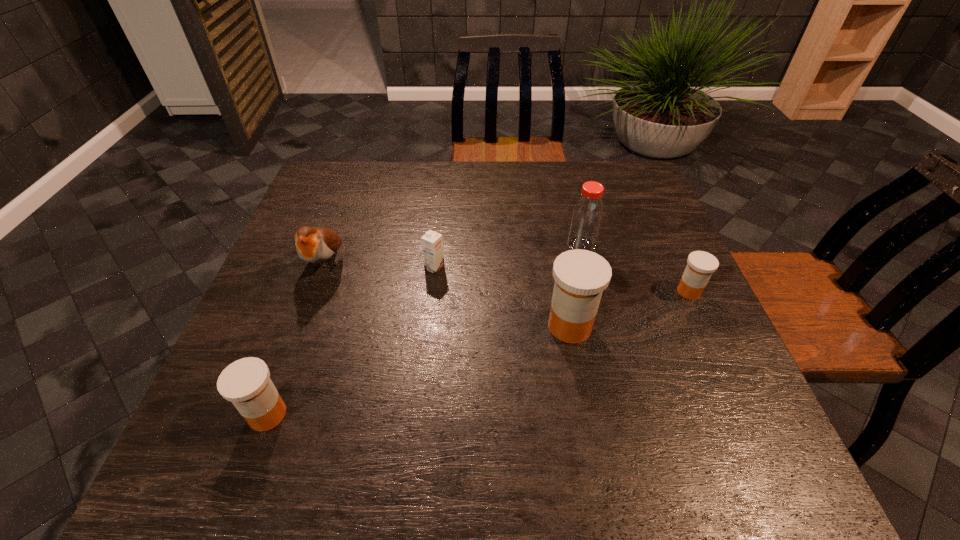
Please point a space for a new medicine to maintain equal intervals. Please provide its 2D coordinates. Your answer should be formatted as a tuple, i.e. [(x, y)], where the tuple contains the x and y coordinates of a point satisfying the conditions above.

[(431, 367)]